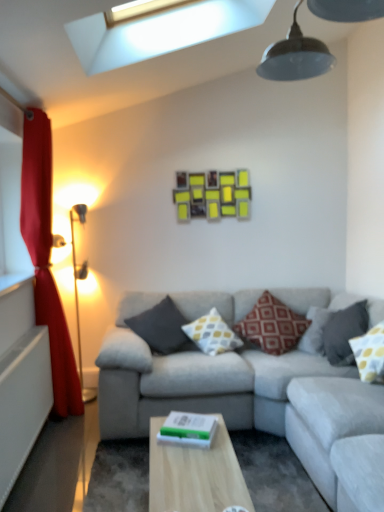
Question: Considering the relative positions of dark gray fabric pillow at right, which ranks as the 4th pillow in left-to-right order, and yellow matte picture frame at upper center in the image provided, is dark gray fabric pillow at right, which ranks as the 4th pillow in left-to-right order, in front of yellow matte picture frame at upper center?

Choices:
 (A) yes
 (B) no

Answer: (A)

Question: Considering the relative sizes of dark gray fabric pillow at right, which ranks as the 4th pillow in left-to-right order, and yellow matte picture frame at upper center in the image provided, is dark gray fabric pillow at right, which ranks as the 4th pillow in left-to-right order, taller than yellow matte picture frame at upper center?

Choices:
 (A) no
 (B) yes

Answer: (A)

Question: From a real-world perspective, is dark gray fabric pillow at right, which ranks as the 4th pillow in left-to-right order, on yellow matte picture frame at upper center?

Choices:
 (A) no
 (B) yes

Answer: (A)

Question: From a real-world perspective, is dark gray fabric pillow at right, which ranks as the 4th pillow in left-to-right order, under yellow matte picture frame at upper center?

Choices:
 (A) yes
 (B) no

Answer: (A)

Question: Is dark gray fabric pillow at right, which ranks as the 4th pillow in left-to-right order, at the right side of yellow matte picture frame at upper center?

Choices:
 (A) yes
 (B) no

Answer: (A)

Question: Considering the positions of red textured pillow at center, which is counted as the 3th pillow, starting from the right, and gray fabric couch at center in the image, is red textured pillow at center, which is counted as the 3th pillow, starting from the right, taller or shorter than gray fabric couch at center?

Choices:
 (A) short
 (B) tall

Answer: (A)

Question: Considering their positions, is red textured pillow at center, which is counted as the 3th pillow, starting from the right, located in front of or behind gray fabric couch at center?

Choices:
 (A) front
 (B) behind

Answer: (B)

Question: From a real-world perspective, is red textured pillow at center, which appears as the third pillow when viewed from the left, above or below gray fabric couch at center?

Choices:
 (A) above
 (B) below

Answer: (A)

Question: From the image's perspective, relative to gray fabric couch at center, is red textured pillow at center, which is counted as the 3th pillow, starting from the right, above or below?

Choices:
 (A) above
 (B) below

Answer: (A)

Question: Visually, is gray fabric couch at center positioned to the left or to the right of gold metallic floor lamp at left?

Choices:
 (A) right
 (B) left

Answer: (A)

Question: Considering their positions, is gray fabric couch at center located in front of or behind gold metallic floor lamp at left?

Choices:
 (A) behind
 (B) front

Answer: (B)

Question: In terms of height, does gray fabric couch at center look taller or shorter compared to gold metallic floor lamp at left?

Choices:
 (A) tall
 (B) short

Answer: (B)

Question: In terms of size, does gray fabric couch at center appear bigger or smaller than gold metallic floor lamp at left?

Choices:
 (A) big
 (B) small

Answer: (A)

Question: Is yellow dotted fabric pillow at right, marked as the fifth pillow in a left-to-right arrangement, inside or outside of yellow dotted pillow at center, positioned as the fourth pillow in right-to-left order?

Choices:
 (A) outside
 (B) inside

Answer: (A)

Question: From a real-world perspective, relative to yellow dotted pillow at center, the 2th pillow from the left, is yellow dotted fabric pillow at right, the first pillow in the right-to-left sequence, vertically above or below?

Choices:
 (A) above
 (B) below

Answer: (A)